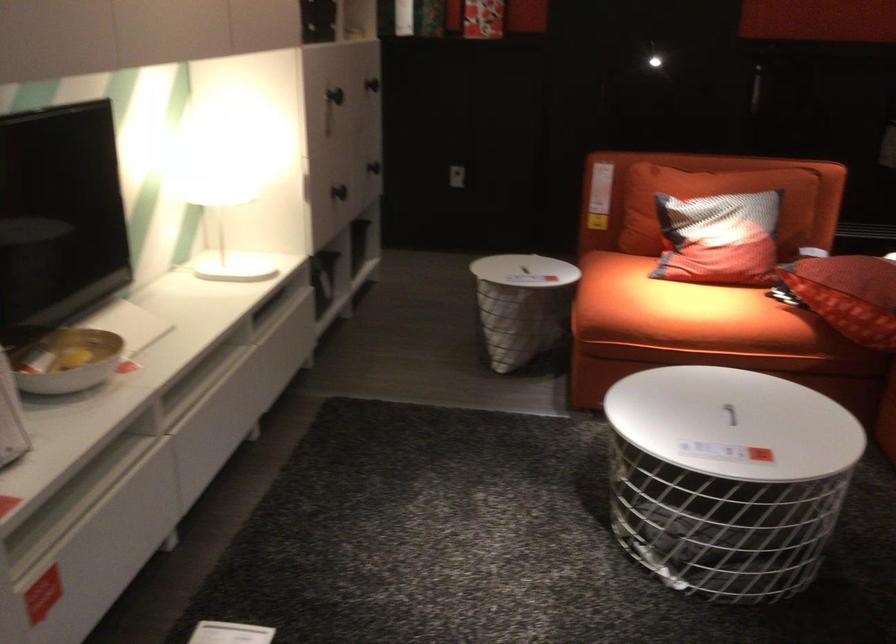
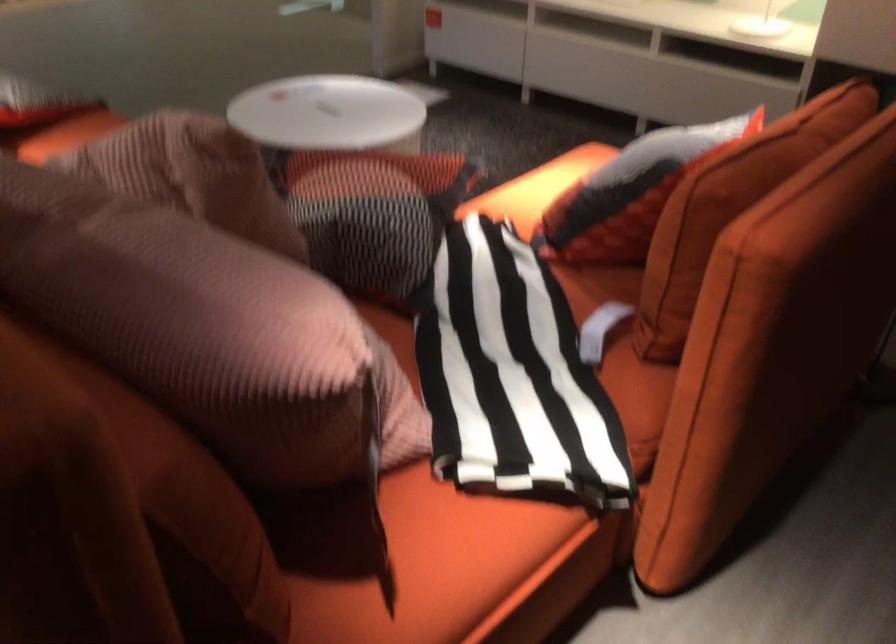
Question: I am providing you with two images of the same scene from different viewpoints. Which of the following objects are not visible in image2?

Choices:
 (A) sofa armrest
 (B) table lid handle
 (C) blue mug
 (D) red patterned pillow

Answer: (B)